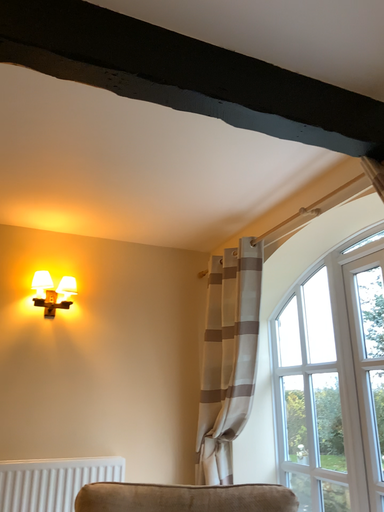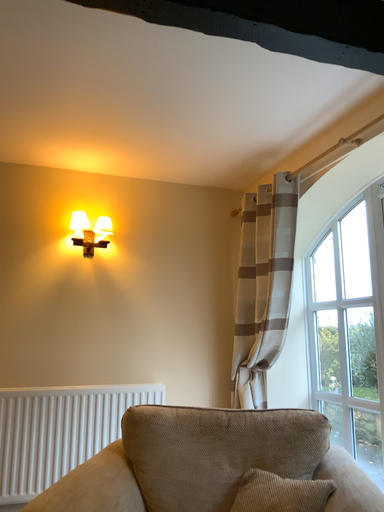
Question: Which way did the camera rotate in the video?

Choices:
 (A) rotated downward
 (B) rotated upward

Answer: (A)